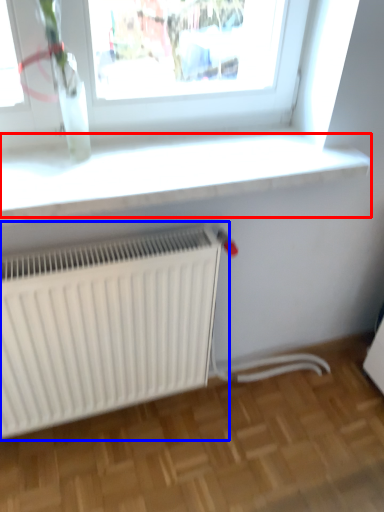
Question: Which object appears closest to the camera in this image, window sill (highlighted by a red box) or radiator (highlighted by a blue box)?

Choices:
 (A) window sill
 (B) radiator

Answer: (A)